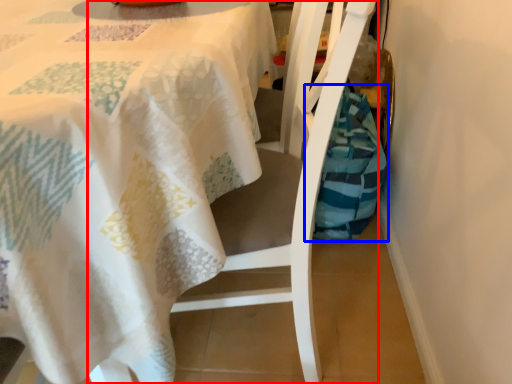
Question: Which object appears farthest to the camera in this image, chair (highlighted by a red box) or material (highlighted by a blue box)?

Choices:
 (A) chair
 (B) material

Answer: (B)